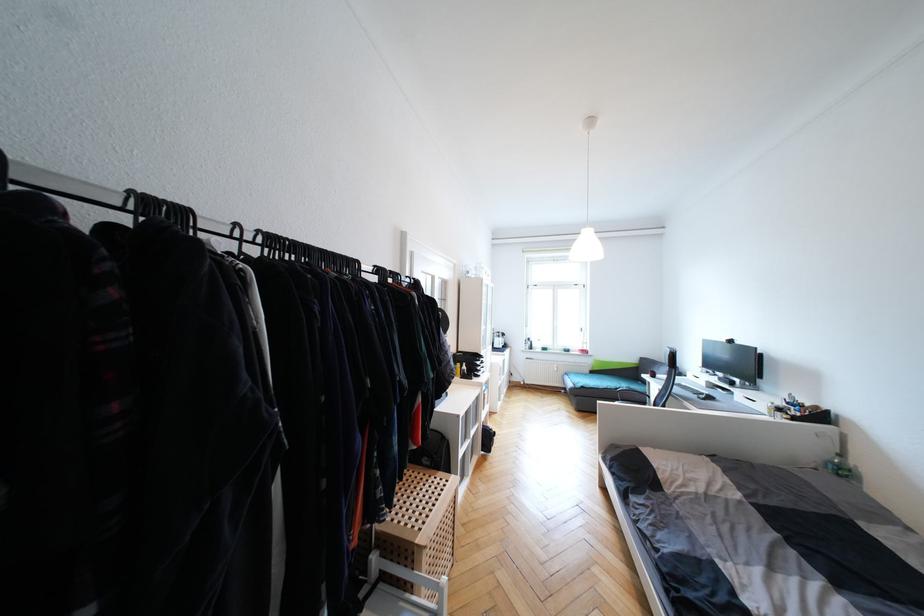
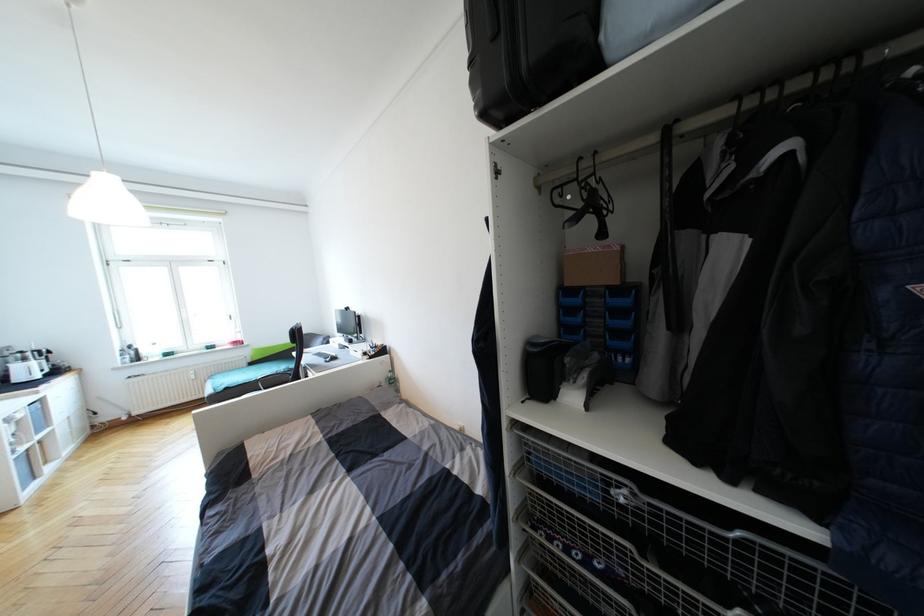
Question: The camera is either moving clockwise (left) or counter-clockwise (right) around the object. The first image is from the beginning of the video and the second image is from the end. Is the camera moving left or right when shooting the video?

Choices:
 (A) Left
 (B) Right

Answer: (A)